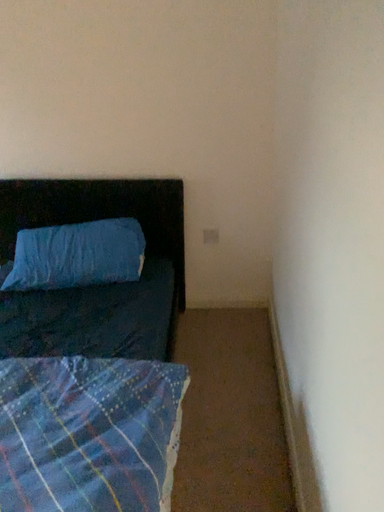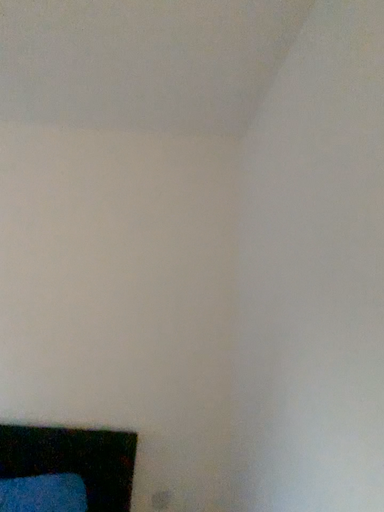
Question: How did the camera likely rotate when shooting the video?

Choices:
 (A) rotated left
 (B) rotated right

Answer: (B)